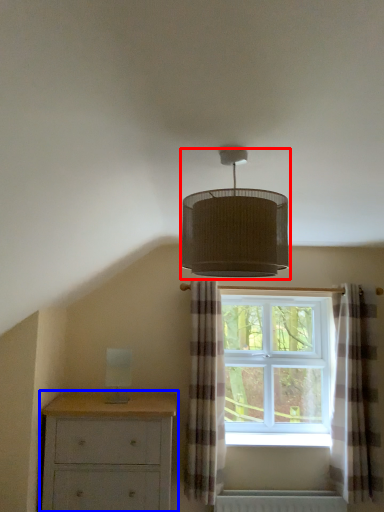
Question: Which of the following is the farthest to the observer, lamp (highlighted by a red box) or chest of drawers (highlighted by a blue box)?

Choices:
 (A) lamp
 (B) chest of drawers

Answer: (B)